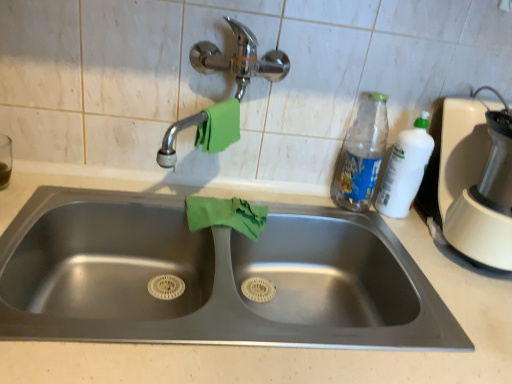
The width and height of the screenshot is (512, 384). Identify the location of white plastic bottle at right. pyautogui.click(x=405, y=169).

The width and height of the screenshot is (512, 384). I want to click on green cloth at sink, which is the 2th hand towel in top-to-bottom order, so (226, 215).

In order to face white plastic blender at right, should I rotate leftwards or rightwards?

It's best to rotate right around 31.432 degrees.

Measure the distance between white plastic blender at right and camera.

They are 79.77 centimeters apart.

The width and height of the screenshot is (512, 384). I want to click on green fabric hand towel at upper center, positioned as the second hand towel in bottom-to-top order, so click(x=219, y=127).

In order to click on white plastic bottle at right in this screenshot , I will do `click(405, 169)`.

Is green fabric hand towel at upper center, positioned as the 1th hand towel in top-to-bottom order, at the right side of stainless steel sink at center?

Yes, green fabric hand towel at upper center, positioned as the 1th hand towel in top-to-bottom order, is to the right of stainless steel sink at center.

Is green fabric hand towel at upper center, positioned as the 1th hand towel in top-to-bottom order, touching stainless steel sink at center?

No.

Is green fabric hand towel at upper center, positioned as the second hand towel in bottom-to-top order, positioned in front of stainless steel sink at center?

That is False.

From the image's perspective, does green fabric hand towel at upper center, positioned as the 1th hand towel in top-to-bottom order, appear lower than stainless steel sink at center?

No, from the image's perspective, green fabric hand towel at upper center, positioned as the 1th hand towel in top-to-bottom order, is not beneath stainless steel sink at center.

Between green fabric hand towel at upper center, positioned as the second hand towel in bottom-to-top order, and green cloth at sink, which is the 2th hand towel in top-to-bottom order, which one appears on the left side from the viewer's perspective?

Positioned to the left is green fabric hand towel at upper center, positioned as the second hand towel in bottom-to-top order.

At what (x,y) coordinates should I click in order to perform the action: click on hand towel that appears below the green fabric hand towel at upper center, positioned as the 1th hand towel in top-to-bottom order (from a real-world perspective). Please return your answer as a coordinate pair (x, y). The width and height of the screenshot is (512, 384). Looking at the image, I should click on (226, 215).

How different are the orientations of green fabric hand towel at upper center, positioned as the 1th hand towel in top-to-bottom order, and green cloth at sink, placed as the 1th hand towel when sorted from bottom to top, in degrees?

The facing directions of green fabric hand towel at upper center, positioned as the 1th hand towel in top-to-bottom order, and green cloth at sink, placed as the 1th hand towel when sorted from bottom to top, are 55.1 degrees apart.

In the scene shown: Is green cloth at sink, which is the 2th hand towel in top-to-bottom order, located within green fabric hand towel at upper center, positioned as the 1th hand towel in top-to-bottom order?

That's incorrect, green cloth at sink, which is the 2th hand towel in top-to-bottom order, is not inside green fabric hand towel at upper center, positioned as the 1th hand towel in top-to-bottom order.

Which of these two, stainless steel sink at center or chrome metallic faucet at upper center, is smaller?

chrome metallic faucet at upper center.

Is the position of stainless steel sink at center more distant than that of chrome metallic faucet at upper center?

No.

From the image's perspective, which object appears higher, stainless steel sink at center or chrome metallic faucet at upper center?

chrome metallic faucet at upper center, from the image's perspective.

From a real-world perspective, is stainless steel sink at center on chrome metallic faucet at upper center?

No, from a real-world perspective, stainless steel sink at center is not above chrome metallic faucet at upper center.

Between white plastic bottle at right and chrome metallic faucet at upper center, which one appears on the left side from the viewer's perspective?

Positioned to the left is chrome metallic faucet at upper center.

Locate an element on the screen. The width and height of the screenshot is (512, 384). cleaning product lying behind the chrome metallic faucet at upper center is located at coordinates (405, 169).

Is white plastic bottle at right not close to chrome metallic faucet at upper center?

white plastic bottle at right is near chrome metallic faucet at upper center, not far away.

Does point (367, 156) lie behind point (199, 214)?

That is True.

Who is taller, translucent plastic bottle at upper right or green cloth at sink, placed as the 1th hand towel when sorted from bottom to top?

translucent plastic bottle at upper right.

Can you confirm if translucent plastic bottle at upper right is wider than green cloth at sink, placed as the 1th hand towel when sorted from bottom to top?

Incorrect, the width of translucent plastic bottle at upper right does not surpass that of green cloth at sink, placed as the 1th hand towel when sorted from bottom to top.

Is green cloth at sink, which is the 2th hand towel in top-to-bottom order, positioned far away from stainless steel sink at center?

No.

Does green cloth at sink, which is the 2th hand towel in top-to-bottom order, have a greater height compared to stainless steel sink at center?

In fact, green cloth at sink, which is the 2th hand towel in top-to-bottom order, may be shorter than stainless steel sink at center.

From a real-world perspective, which object rests below the other?

stainless steel sink at center.

Is point (225, 206) positioned after point (27, 291)?

Yes, point (225, 206) is behind point (27, 291).

Are white plastic blender at right and chrome metallic faucet at upper center located far from each other?

No, there isn't a large distance between white plastic blender at right and chrome metallic faucet at upper center.

Based on their sizes in the image, would you say white plastic blender at right is bigger or smaller than chrome metallic faucet at upper center?

Clearly, white plastic blender at right is larger in size than chrome metallic faucet at upper center.

You are a GUI agent. You are given a task and a screenshot of the screen. Output one action in this format:
    pyautogui.click(x=<x>, y=<y>)
    Task: Click on the blender lying below the chrome metallic faucet at upper center (from the image's perspective)
    The image size is (512, 384).
    Given the screenshot: What is the action you would take?
    pyautogui.click(x=472, y=185)

Which of these two, white plastic blender at right or chrome metallic faucet at upper center, is thinner?

With smaller width is chrome metallic faucet at upper center.

This screenshot has width=512, height=384. I want to click on the 1st hand towel to the right of the stainless steel sink at center, counting from the anchor's position, so click(x=219, y=127).

Find the location of a particular element. hand towel above the green cloth at sink, placed as the 1th hand towel when sorted from bottom to top (from a real-world perspective) is located at coordinates (219, 127).

From the image, which object appears to be nearer to chrome metallic faucet at upper center, translucent plastic bottle at upper right or green fabric hand towel at upper center, positioned as the second hand towel in bottom-to-top order?

Among the two, green fabric hand towel at upper center, positioned as the second hand towel in bottom-to-top order, is located nearer to chrome metallic faucet at upper center.

From the image, which object appears to be farther from stainless steel sink at center, green fabric hand towel at upper center, positioned as the 1th hand towel in top-to-bottom order, or green cloth at sink, which is the 2th hand towel in top-to-bottom order?

green fabric hand towel at upper center, positioned as the 1th hand towel in top-to-bottom order.

Which object lies nearer to the anchor point chrome metallic faucet at upper center, white plastic blender at right or stainless steel sink at center?

stainless steel sink at center is closer to chrome metallic faucet at upper center.

Based on their spatial positions, is white plastic blender at right or chrome metallic faucet at upper center closer to stainless steel sink at center?

chrome metallic faucet at upper center is positioned closer to the anchor stainless steel sink at center.

Based on their spatial positions, is green fabric hand towel at upper center, positioned as the second hand towel in bottom-to-top order, or white plastic bottle at right closer to translucent plastic bottle at upper right?

Among the two, white plastic bottle at right is located nearer to translucent plastic bottle at upper right.

In the scene shown: When comparing their distances from stainless steel sink at center, does chrome metallic faucet at upper center or white plastic blender at right seem further?

white plastic blender at right lies further to stainless steel sink at center than the other object.

Considering their positions, is stainless steel sink at center positioned closer to white plastic blender at right than green cloth at sink, which is the 2th hand towel in top-to-bottom order?

stainless steel sink at center.

Based on the photo, based on their spatial positions, is stainless steel sink at center or green cloth at sink, placed as the 1th hand towel when sorted from bottom to top, closer to chrome metallic faucet at upper center?

green cloth at sink, placed as the 1th hand towel when sorted from bottom to top.

You are a GUI agent. You are given a task and a screenshot of the screen. Output one action in this format:
    pyautogui.click(x=<x>, y=<y>)
    Task: Click on the tap between green fabric hand towel at upper center, positioned as the second hand towel in bottom-to-top order, and white plastic bottle at right, in the horizontal direction
    This screenshot has width=512, height=384.
    Given the screenshot: What is the action you would take?
    pyautogui.click(x=227, y=100)

The image size is (512, 384). Identify the location of tap between green cloth at sink, which is the 2th hand towel in top-to-bottom order, and translucent plastic bottle at upper right, in the horizontal direction. (227, 100).

Identify the location of tap between green fabric hand towel at upper center, positioned as the second hand towel in bottom-to-top order, and white plastic blender at right, in the horizontal direction. The width and height of the screenshot is (512, 384). (227, 100).

You are a GUI agent. You are given a task and a screenshot of the screen. Output one action in this format:
    pyautogui.click(x=<x>, y=<y>)
    Task: Click on the tap situated between stainless steel sink at center and white plastic blender at right from left to right
    This screenshot has height=384, width=512.
    Given the screenshot: What is the action you would take?
    pyautogui.click(x=227, y=100)